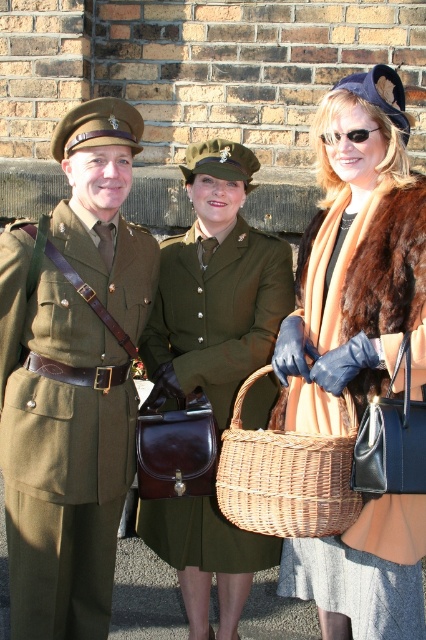
Does matte olive-green uniform at center have a lesser width compared to olive green fabric uniform at center?

Yes, matte olive-green uniform at center is thinner than olive green fabric uniform at center.

Can you confirm if matte olive-green uniform at center is wider than olive green fabric uniform at center?

No, matte olive-green uniform at center is not wider than olive green fabric uniform at center.

Does point (60, 484) come behind point (267, 316)?

No, (60, 484) is closer to viewer.

I want to click on matte olive-green uniform at center, so click(72, 378).

Is matte olive-green uniform at center shorter than fur coat at center?

In fact, matte olive-green uniform at center may be taller than fur coat at center.

Between matte olive-green uniform at center and fur coat at center, which one appears on the left side from the viewer's perspective?

matte olive-green uniform at center is more to the left.

Measure the distance between matte olive-green uniform at center and camera.

They are 4.09 meters apart.

Where is `matte olive-green uniform at center`? matte olive-green uniform at center is located at coordinates (72, 378).

Which of these two, olive green fabric uniform at center or woven brown basket at center, stands taller?

olive green fabric uniform at center

Describe the element at coordinates (218, 310) in the screenshot. This screenshot has width=426, height=640. I see `olive green fabric uniform at center` at that location.

Which is behind, point (183, 241) or point (245, 508)?

Point (183, 241)

This screenshot has width=426, height=640. I want to click on olive green fabric uniform at center, so click(218, 310).